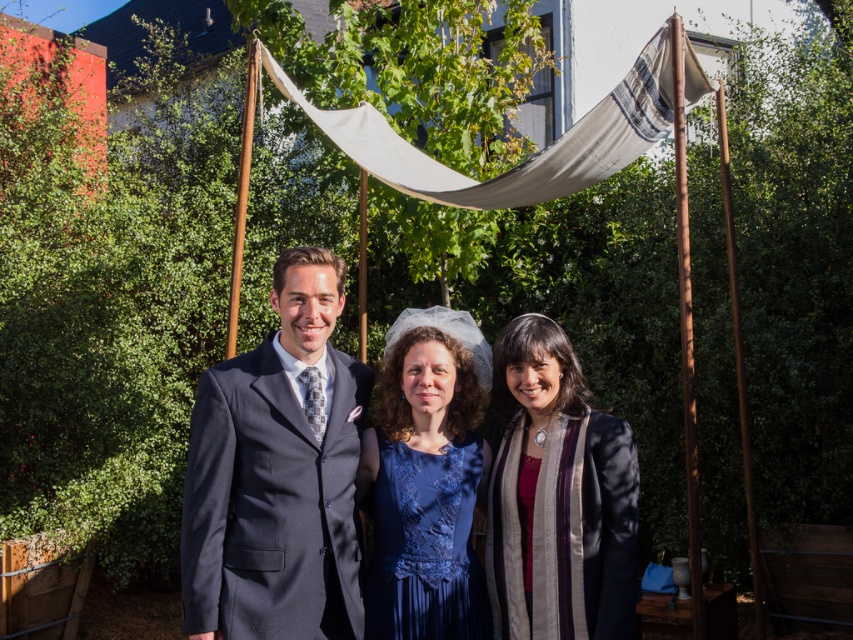
You are standing in the garden and want to take a photo of the blue lace dress at center. If your camera has a maximum focus range of 4 meters, will it be able to capture the dress clearly?

The blue lace dress at center is 3.75 meters away from the viewer. Since the camera can focus up to 4 meters, it will be able to capture the dress clearly within the focus range.

You are at the center of the image and want to move towards the blue lace dress at center. Which direction should you move?

The blue lace dress at center is already at the center of the image, so you don not need to move in any direction to reach it.